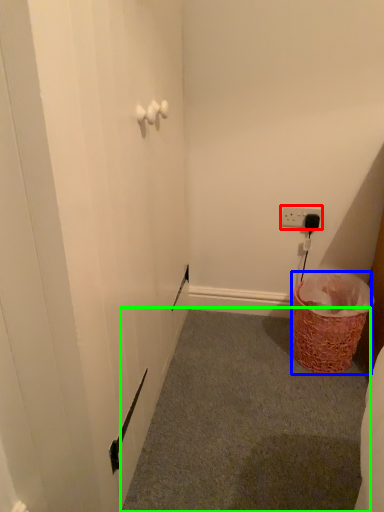
Question: Estimate the real-world distances between objects in this image. Which object is farther from electric outlet (highlighted by a red box), basket (highlighted by a blue box) or plain (highlighted by a green box)?

Choices:
 (A) basket
 (B) plain

Answer: (B)